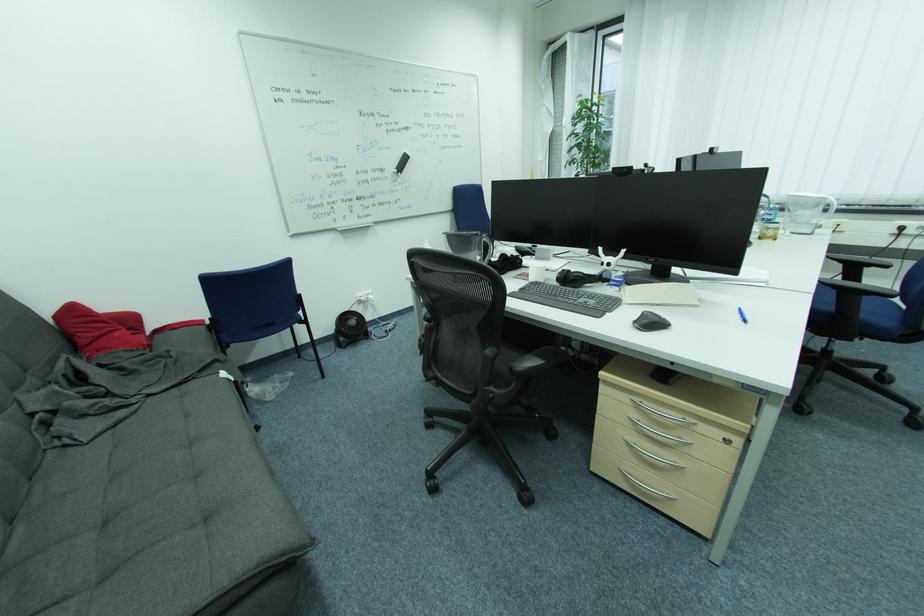
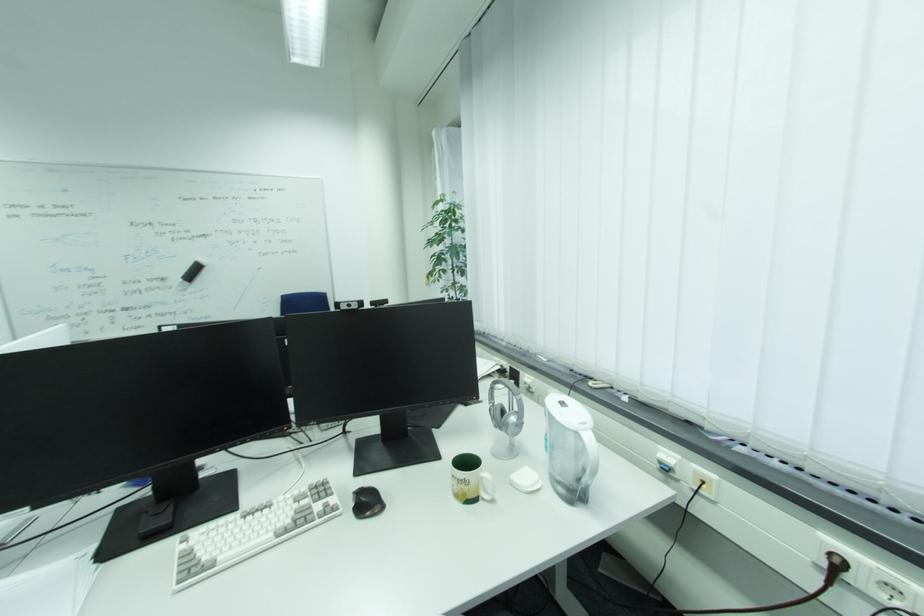
Which direction would the cameraman need to move to produce the second image?

The cameraman walked toward right, forward.